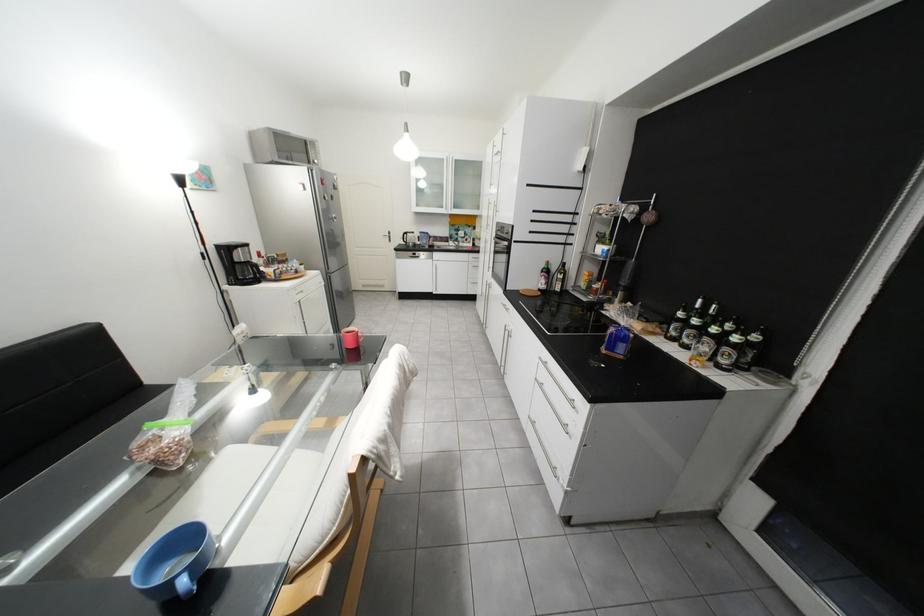
The image size is (924, 616). What do you see at coordinates (557, 384) in the screenshot? I see `the silver drawer handle` at bounding box center [557, 384].